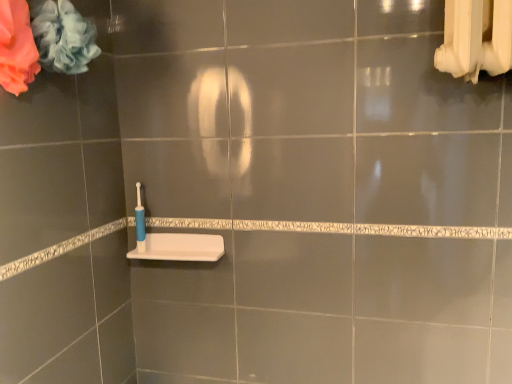
Question: Would you say soft pink fabric at upper left, arranged as the 1th flower when viewed from the left, contains white matte sink at lower center?

Choices:
 (A) no
 (B) yes

Answer: (A)

Question: Would you consider soft pink fabric at upper left, placed as the second flower when sorted from right to left, to be distant from white matte sink at lower center?

Choices:
 (A) no
 (B) yes

Answer: (A)

Question: From a real-world perspective, is soft pink fabric at upper left, arranged as the 1th flower when viewed from the left, positioned over white matte sink at lower center based on gravity?

Choices:
 (A) no
 (B) yes

Answer: (B)

Question: Is soft pink fabric at upper left, placed as the second flower when sorted from right to left, aimed at white matte sink at lower center?

Choices:
 (A) yes
 (B) no

Answer: (B)

Question: Does soft pink fabric at upper left, arranged as the 1th flower when viewed from the left, have a lesser width compared to white matte sink at lower center?

Choices:
 (A) no
 (B) yes

Answer: (B)

Question: Considering the relative positions of soft pink fabric at upper left, arranged as the 1th flower when viewed from the left, and white matte sink at lower center in the image provided, is soft pink fabric at upper left, arranged as the 1th flower when viewed from the left, to the left of white matte sink at lower center from the viewer's perspective?

Choices:
 (A) yes
 (B) no

Answer: (A)

Question: Is white matte sink at lower center oriented away from blue plastic toothbrush at lower left?

Choices:
 (A) no
 (B) yes

Answer: (A)

Question: From the image's perspective, is white matte sink at lower center beneath blue plastic toothbrush at lower left?

Choices:
 (A) no
 (B) yes

Answer: (B)

Question: Could you tell me if white matte sink at lower center is facing blue plastic toothbrush at lower left?

Choices:
 (A) no
 (B) yes

Answer: (A)

Question: Are white matte sink at lower center and blue plastic toothbrush at lower left far apart?

Choices:
 (A) no
 (B) yes

Answer: (A)

Question: Is white matte sink at lower center wider than blue plastic toothbrush at lower left?

Choices:
 (A) no
 (B) yes

Answer: (B)

Question: Is white matte sink at lower center at the right side of blue plastic toothbrush at lower left?

Choices:
 (A) no
 (B) yes

Answer: (B)

Question: Is soft blue fabric at upper left, the first flower positioned from the right, oriented towards white matte sink at lower center?

Choices:
 (A) yes
 (B) no

Answer: (B)